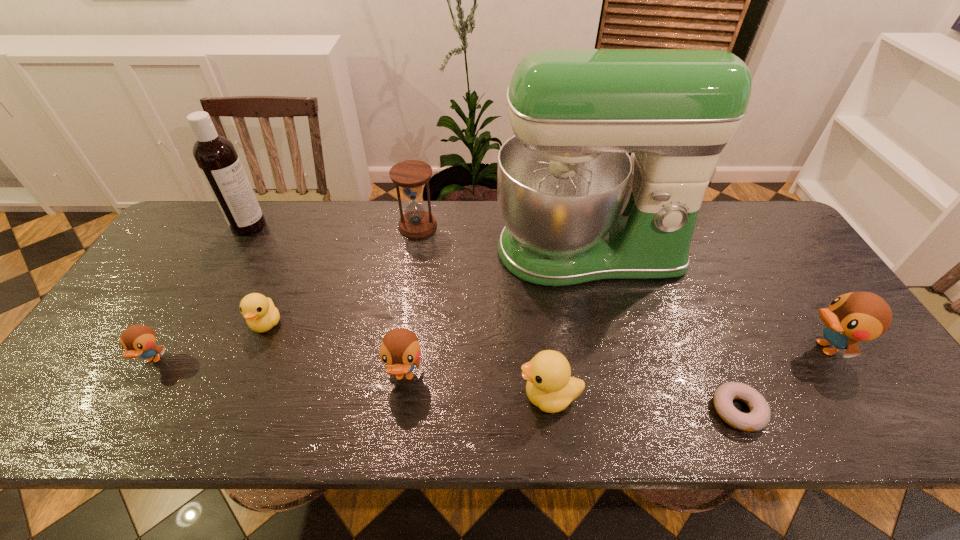
Identify the location of the tallest object. This screenshot has height=540, width=960. (577, 208).

In order to click on green mixer in this screenshot , I will do `click(577, 208)`.

Identify the location of dishwasher detergent. (216, 157).

Find the location of a particular element. The height and width of the screenshot is (540, 960). hourglass is located at coordinates (410, 175).

Locate an element on the screen. The width and height of the screenshot is (960, 540). the rightmost duck is located at coordinates (857, 316).

Image resolution: width=960 pixels, height=540 pixels. Find the location of `the tallest duck`. the tallest duck is located at coordinates (857, 316).

This screenshot has width=960, height=540. Find the location of `the second blue duck from left to right`. the second blue duck from left to right is located at coordinates (400, 350).

Where is `the second smallest blue duck`? Image resolution: width=960 pixels, height=540 pixels. the second smallest blue duck is located at coordinates (400, 350).

At what (x,y) coordinates should I click in order to perform the action: click on the nearer yellow duck. Please return your answer as a coordinate pair (x, y). Looking at the image, I should click on (549, 386).

This screenshot has height=540, width=960. I want to click on the bigger yellow duck, so [x=549, y=386].